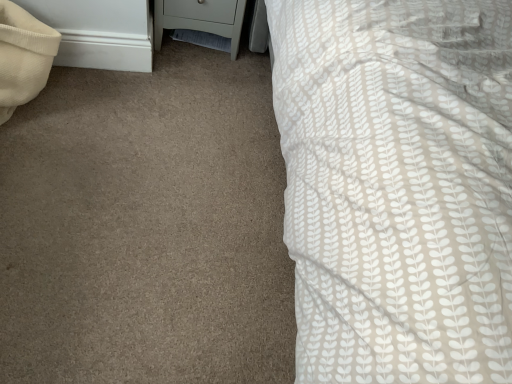
Question: Could you tell me if light gray matte nightstand at lower left is facing beige textured pillow at left?

Choices:
 (A) yes
 (B) no

Answer: (B)

Question: Can you confirm if light gray matte nightstand at lower left is smaller than beige textured pillow at left?

Choices:
 (A) yes
 (B) no

Answer: (B)

Question: Is light gray matte nightstand at lower left shorter than beige textured pillow at left?

Choices:
 (A) no
 (B) yes

Answer: (B)

Question: From the image's perspective, is light gray matte nightstand at lower left located beneath beige textured pillow at left?

Choices:
 (A) yes
 (B) no

Answer: (B)

Question: From a real-world perspective, is light gray matte nightstand at lower left over beige textured pillow at left?

Choices:
 (A) no
 (B) yes

Answer: (A)

Question: Does light gray matte nightstand at lower left have a lesser width compared to beige textured pillow at left?

Choices:
 (A) yes
 (B) no

Answer: (B)

Question: Is beige textured pillow at left facing towards light gray matte nightstand at lower left?

Choices:
 (A) yes
 (B) no

Answer: (B)

Question: Is beige textured pillow at left to the right of light gray matte nightstand at lower left from the viewer's perspective?

Choices:
 (A) yes
 (B) no

Answer: (B)

Question: Can you confirm if beige textured pillow at left is positioned to the left of light gray matte nightstand at lower left?

Choices:
 (A) no
 (B) yes

Answer: (B)

Question: Can you confirm if beige textured pillow at left is shorter than light gray matte nightstand at lower left?

Choices:
 (A) no
 (B) yes

Answer: (A)

Question: Considering the relative sizes of beige textured pillow at left and light gray matte nightstand at lower left in the image provided, is beige textured pillow at left thinner than light gray matte nightstand at lower left?

Choices:
 (A) no
 (B) yes

Answer: (B)

Question: From a real-world perspective, is beige textured pillow at left below light gray matte nightstand at lower left?

Choices:
 (A) yes
 (B) no

Answer: (B)

Question: Considering the relative positions of light gray matte nightstand at lower left and beige textured pillow at left in the image provided, is light gray matte nightstand at lower left to the left or to the right of beige textured pillow at left?

Choices:
 (A) left
 (B) right

Answer: (B)